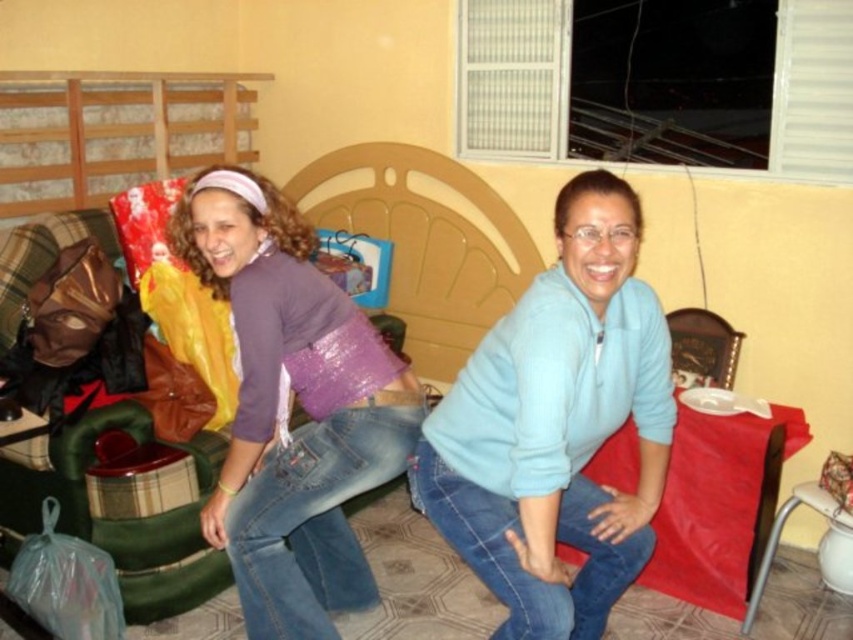
Question: Which point appears farthest from the camera in this image?

Choices:
 (A) (569, 339)
 (B) (363, 561)

Answer: (B)

Question: Is light blue fleece at center further to camera compared to purple sequined purse at center?

Choices:
 (A) yes
 (B) no

Answer: (B)

Question: Which point is closer to the camera?

Choices:
 (A) (427, 509)
 (B) (244, 284)

Answer: (A)

Question: Does light blue fleece at center have a smaller size compared to purple sequined purse at center?

Choices:
 (A) yes
 (B) no

Answer: (B)

Question: Does light blue fleece at center have a lesser width compared to purple sequined purse at center?

Choices:
 (A) no
 (B) yes

Answer: (B)

Question: Which point is closer to the camera?

Choices:
 (A) (482, 344)
 (B) (340, 532)

Answer: (A)